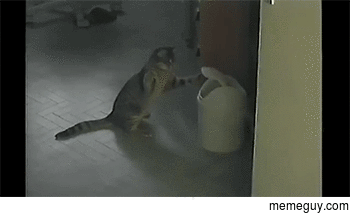
Find the location of `floor`. floor is located at coordinates (90, 153).